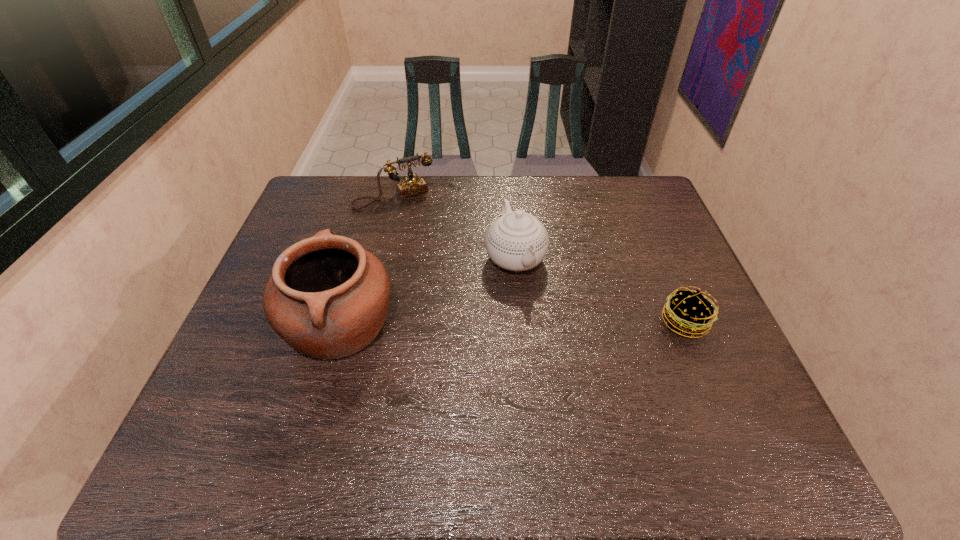
At what (x,y) coordinates should I click in order to perform the action: click on the tallest object. Please return your answer as a coordinate pair (x, y). The image size is (960, 540). Looking at the image, I should click on (327, 297).

Find the location of a particular element. the rightmost object is located at coordinates (689, 312).

Find the location of a particular element. This screenshot has height=540, width=960. patty is located at coordinates (689, 312).

Find the location of a particular element. The width and height of the screenshot is (960, 540). the third tallest object is located at coordinates (412, 185).

Where is `the farthest object`? This screenshot has width=960, height=540. the farthest object is located at coordinates (412, 185).

Locate an element on the screen. The width and height of the screenshot is (960, 540). the second tallest object is located at coordinates (517, 241).

Image resolution: width=960 pixels, height=540 pixels. I want to click on the third object from left to right, so click(517, 241).

Locate an element on the screen. The image size is (960, 540). vacant space situated on the right of the tallest object is located at coordinates (437, 325).

This screenshot has height=540, width=960. In order to click on free space located 0.140m on the front of the patty in this screenshot , I will do `click(715, 394)`.

Image resolution: width=960 pixels, height=540 pixels. Identify the location of vacant region located 0.200m on the front-facing side of the third tallest object. (429, 247).